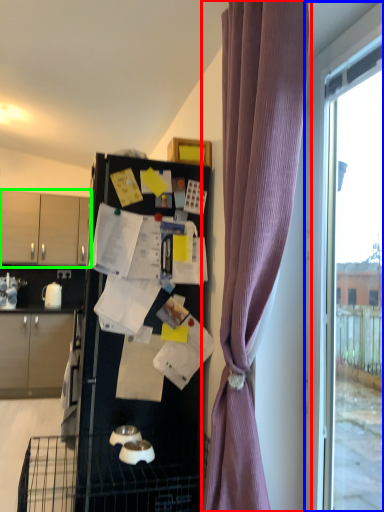
Question: Which object is the farthest from curtain (highlighted by a red box)? Choose among these: window (highlighted by a blue box) or cabinetry (highlighted by a green box).

Choices:
 (A) window
 (B) cabinetry

Answer: (B)